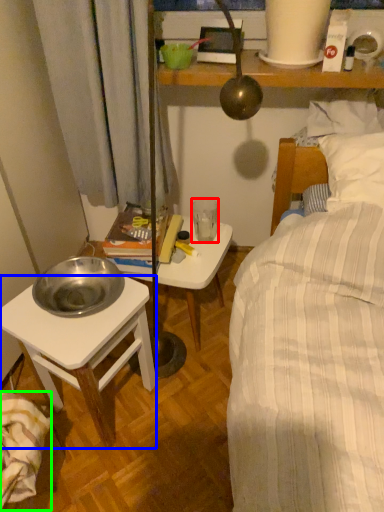
Question: Which object is the closest to the coffee cup (highlighted by a red box)? Choose among these: desk (highlighted by a blue box) or blanket (highlighted by a green box).

Choices:
 (A) desk
 (B) blanket

Answer: (A)